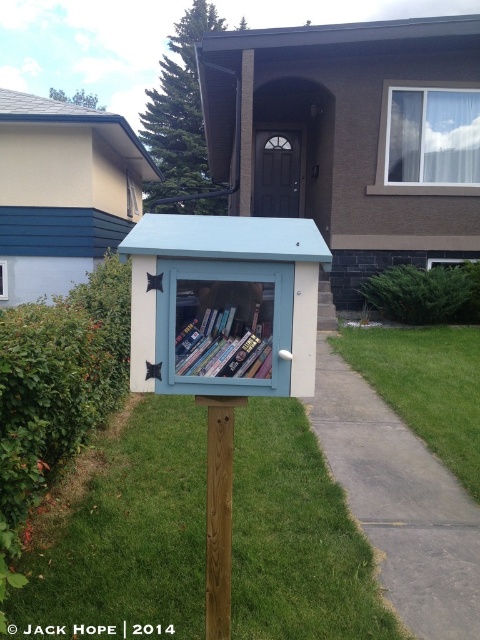
You are trying to place a new book into the book exchange box. The brown wooden post at center is in the way. Can you move the hardcover books at center to make space?

The brown wooden post at center has a larger size compared to hardcover books at center, so moving the hardcover books at center might not be sufficient to make space around the larger post.

You are a delivery person trying to place a new stack of books next to the brown wooden post at center. The stack is as tall as the hardcover books at center. Will the stack be shorter than the post?

The brown wooden post at center has a greater height compared to hardcover books at center, so yes, the stack will be shorter than the post.